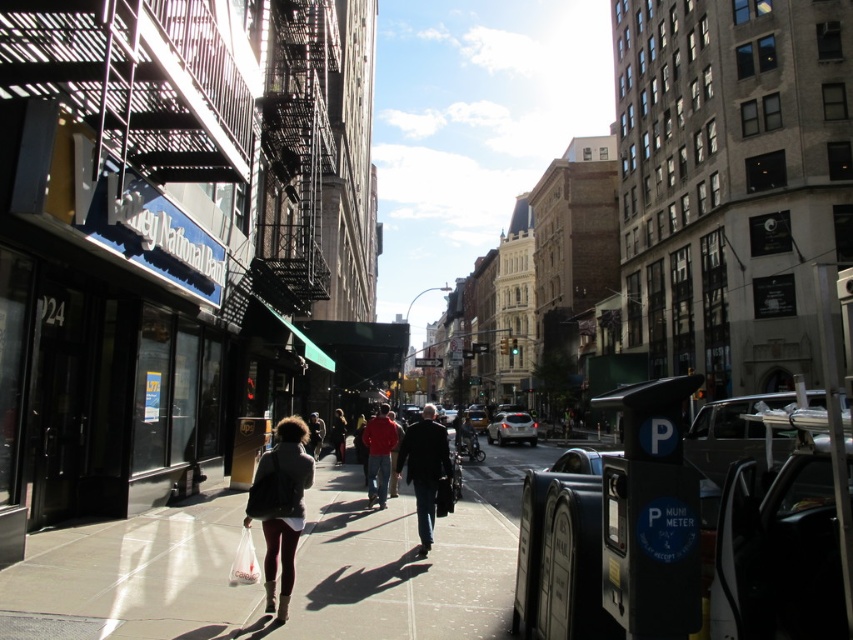
Question: Which of the following is the farthest from the observer?

Choices:
 (A) (302, 621)
 (B) (248, 580)

Answer: (A)

Question: Does white plastic bag at lower center appear on the right side of dark brown leather jacket at center?

Choices:
 (A) no
 (B) yes

Answer: (B)

Question: Based on their relative distances, which object is farther from the white plastic bag at lower center?

Choices:
 (A) smooth concrete sidewalk at center
 (B) dark brown leather jacket at center
 (C) dark gray jacket at center
 (D) leather jacket at center

Answer: (B)

Question: Does dark gray jacket at center have a greater width compared to dark brown leather jacket at center?

Choices:
 (A) no
 (B) yes

Answer: (A)

Question: Considering the real-world distances, which object is closest to the dark gray jacket at center?

Choices:
 (A) white plastic bag at lower center
 (B) leather jacket at center
 (C) dark brown leather jacket at center
 (D) smooth concrete sidewalk at center

Answer: (D)

Question: Is dark gray jacket at center to the right of dark brown leather jacket at center from the viewer's perspective?

Choices:
 (A) yes
 (B) no

Answer: (A)